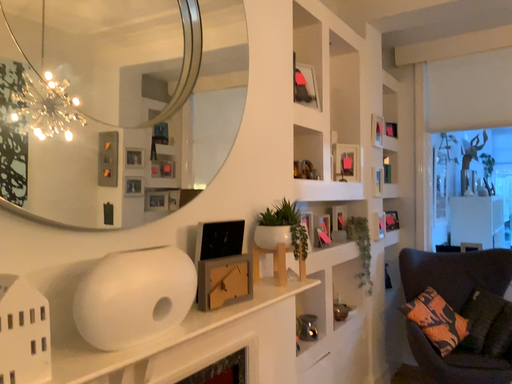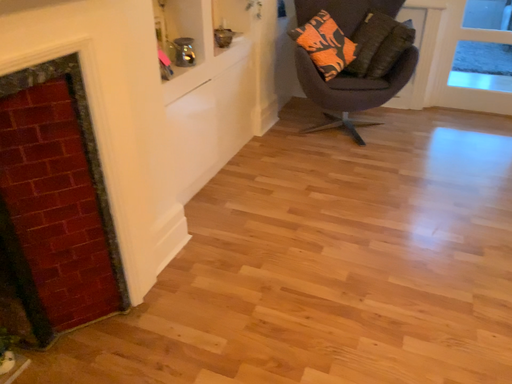
Question: How did the camera likely rotate when shooting the video?

Choices:
 (A) rotated right
 (B) rotated left

Answer: (A)